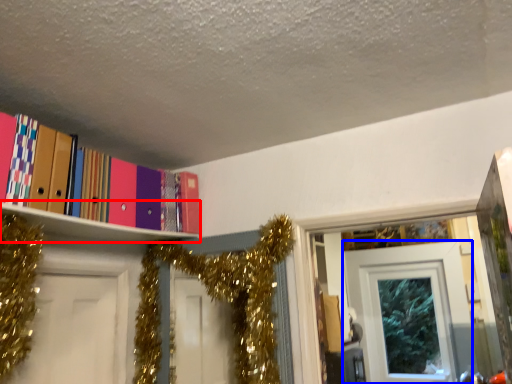
Question: Which object appears closest to the camera in this image, shelf (highlighted by a red box) or door (highlighted by a blue box)?

Choices:
 (A) shelf
 (B) door

Answer: (A)